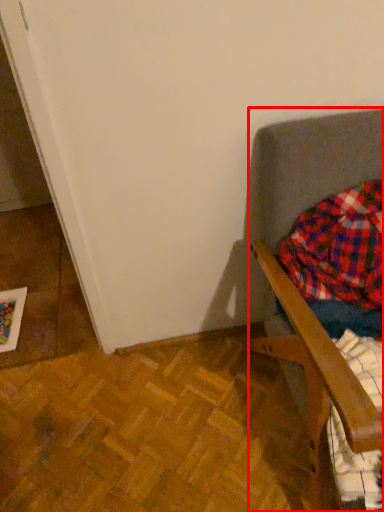
Question: From the image, what is the correct spatial relationship of furniture (annotated by the red box) in relation to flannel?

Choices:
 (A) left
 (B) right

Answer: (B)